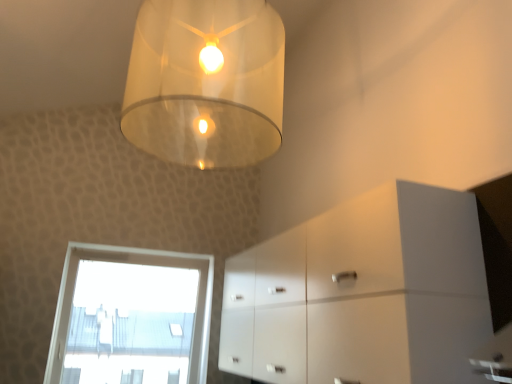
Question: Is transparent glass window at lower left at the right side of translucent glass lampshade at upper center?

Choices:
 (A) no
 (B) yes

Answer: (A)

Question: Considering the relative positions of transparent glass window at lower left and translucent glass lampshade at upper center in the image provided, is transparent glass window at lower left in front of translucent glass lampshade at upper center?

Choices:
 (A) no
 (B) yes

Answer: (A)

Question: From a real-world perspective, is transparent glass window at lower left located higher than translucent glass lampshade at upper center?

Choices:
 (A) yes
 (B) no

Answer: (B)

Question: From the image's perspective, is transparent glass window at lower left under translucent glass lampshade at upper center?

Choices:
 (A) yes
 (B) no

Answer: (A)

Question: Are transparent glass window at lower left and translucent glass lampshade at upper center far apart?

Choices:
 (A) yes
 (B) no

Answer: (A)

Question: Would you say translucent glass lampshade at upper center is part of transparent glass window at lower left's contents?

Choices:
 (A) no
 (B) yes

Answer: (A)

Question: Is translucent glass lampshade at upper center to the right of white glossy cabinet at lower right from the viewer's perspective?

Choices:
 (A) no
 (B) yes

Answer: (A)

Question: From a real-world perspective, is translucent glass lampshade at upper center on white glossy cabinet at lower right?

Choices:
 (A) no
 (B) yes

Answer: (B)

Question: Could you tell me if translucent glass lampshade at upper center is turned towards white glossy cabinet at lower right?

Choices:
 (A) yes
 (B) no

Answer: (B)

Question: Is translucent glass lampshade at upper center at the left side of white glossy cabinet at lower right?

Choices:
 (A) yes
 (B) no

Answer: (A)

Question: Considering the relative sizes of translucent glass lampshade at upper center and white glossy cabinet at lower right in the image provided, is translucent glass lampshade at upper center shorter than white glossy cabinet at lower right?

Choices:
 (A) yes
 (B) no

Answer: (B)

Question: From a real-world perspective, is translucent glass lampshade at upper center positioned under white glossy cabinet at lower right based on gravity?

Choices:
 (A) no
 (B) yes

Answer: (A)

Question: Does white glossy cabinet at lower right have a lesser height compared to transparent glass window at lower left?

Choices:
 (A) no
 (B) yes

Answer: (B)